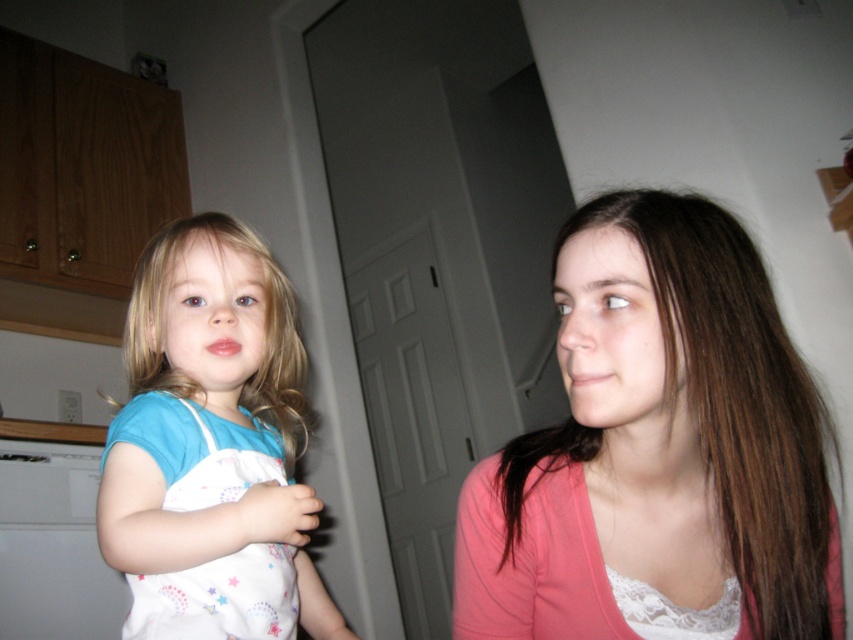
Question: Is pink fabric at center positioned at the back of white cotton dress at left?

Choices:
 (A) yes
 (B) no

Answer: (B)

Question: Which point is farther from the camera taking this photo?

Choices:
 (A) (581, 428)
 (B) (212, 227)

Answer: (B)

Question: Does pink fabric at center appear over white cotton dress at left?

Choices:
 (A) yes
 (B) no

Answer: (A)

Question: Which object is closer to the camera taking this photo?

Choices:
 (A) pink fabric at center
 (B) white cotton dress at left

Answer: (A)

Question: Is pink fabric at center thinner than white cotton dress at left?

Choices:
 (A) no
 (B) yes

Answer: (A)